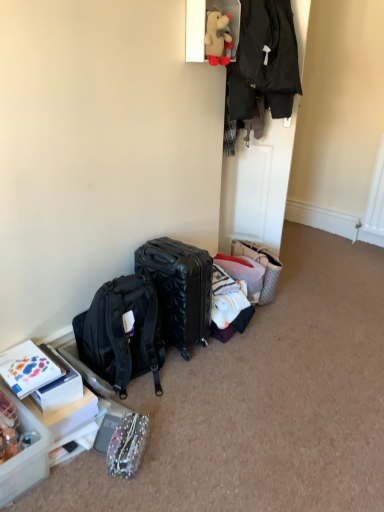
Question: Is translucent plastic container at lower left positioned with its back to white cotton shirt at center, placed as the 1th clothing when sorted from bottom to top?

Choices:
 (A) yes
 (B) no

Answer: (B)

Question: Considering the relative sizes of translucent plastic container at lower left and white cotton shirt at center, arranged as the 2th clothing when viewed from the top, in the image provided, is translucent plastic container at lower left thinner than white cotton shirt at center, arranged as the 2th clothing when viewed from the top,?

Choices:
 (A) yes
 (B) no

Answer: (B)

Question: From the image's perspective, would you say translucent plastic container at lower left is positioned over white cotton shirt at center, placed as the 1th clothing when sorted from bottom to top?

Choices:
 (A) yes
 (B) no

Answer: (B)

Question: Can you confirm if translucent plastic container at lower left is positioned to the left of white cotton shirt at center, placed as the 1th clothing when sorted from bottom to top?

Choices:
 (A) no
 (B) yes

Answer: (B)

Question: Is translucent plastic container at lower left shorter than white cotton shirt at center, arranged as the 2th clothing when viewed from the top?

Choices:
 (A) no
 (B) yes

Answer: (A)

Question: Is translucent plastic container at lower left bigger than white cotton shirt at center, placed as the 1th clothing when sorted from bottom to top?

Choices:
 (A) yes
 (B) no

Answer: (A)

Question: Is the position of white cotton shirt at center, placed as the 1th clothing when sorted from bottom to top, more distant than that of quilted beige handbag at lower right?

Choices:
 (A) yes
 (B) no

Answer: (B)

Question: Is white cotton shirt at center, arranged as the 2th clothing when viewed from the top, aimed at quilted beige handbag at lower right?

Choices:
 (A) yes
 (B) no

Answer: (B)

Question: Is white cotton shirt at center, placed as the 1th clothing when sorted from bottom to top, wider than quilted beige handbag at lower right?

Choices:
 (A) no
 (B) yes

Answer: (A)

Question: Is there a large distance between white cotton shirt at center, arranged as the 2th clothing when viewed from the top, and quilted beige handbag at lower right?

Choices:
 (A) yes
 (B) no

Answer: (B)

Question: Is white cotton shirt at center, placed as the 1th clothing when sorted from bottom to top, oriented away from quilted beige handbag at lower right?

Choices:
 (A) no
 (B) yes

Answer: (A)

Question: Is white cotton shirt at center, arranged as the 2th clothing when viewed from the top, at the right side of quilted beige handbag at lower right?

Choices:
 (A) yes
 (B) no

Answer: (B)

Question: From a real-world perspective, does white cotton shirt at center, arranged as the 2th clothing when viewed from the top, stand above black textured suitcase at center?

Choices:
 (A) no
 (B) yes

Answer: (B)